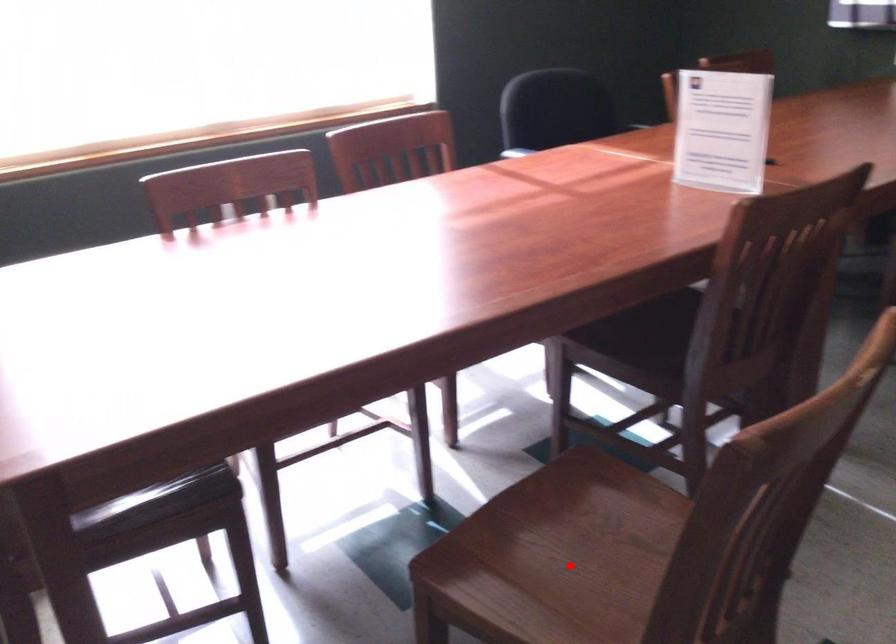
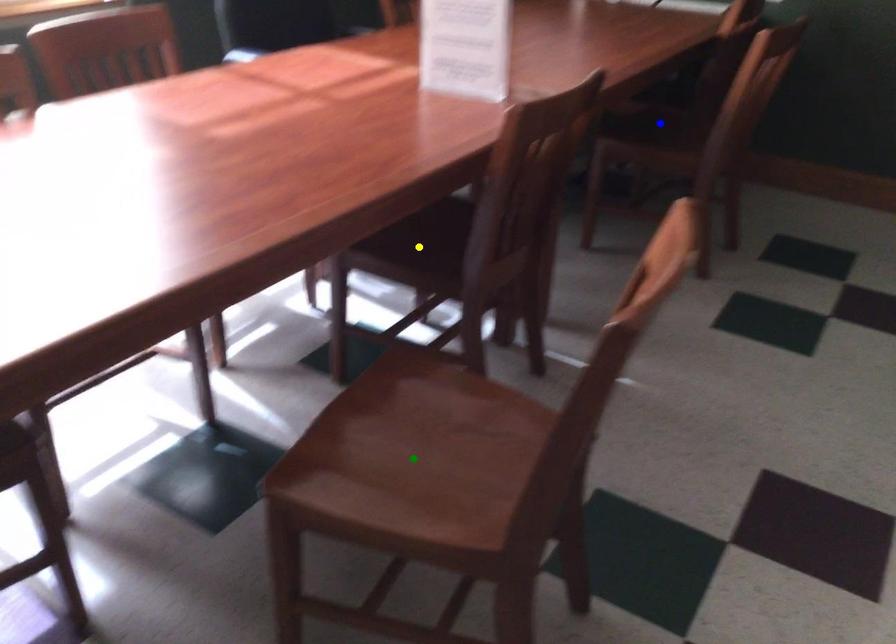
Question: I am providing you with two images of the same scene from different viewpoints. A red point is marked on the first image. You are given multiple points on the second image. Which point in image 2 is actually the same real-world point as the red point in image 1?

Choices:
 (A) green point
 (B) yellow point
 (C) blue point

Answer: (A)